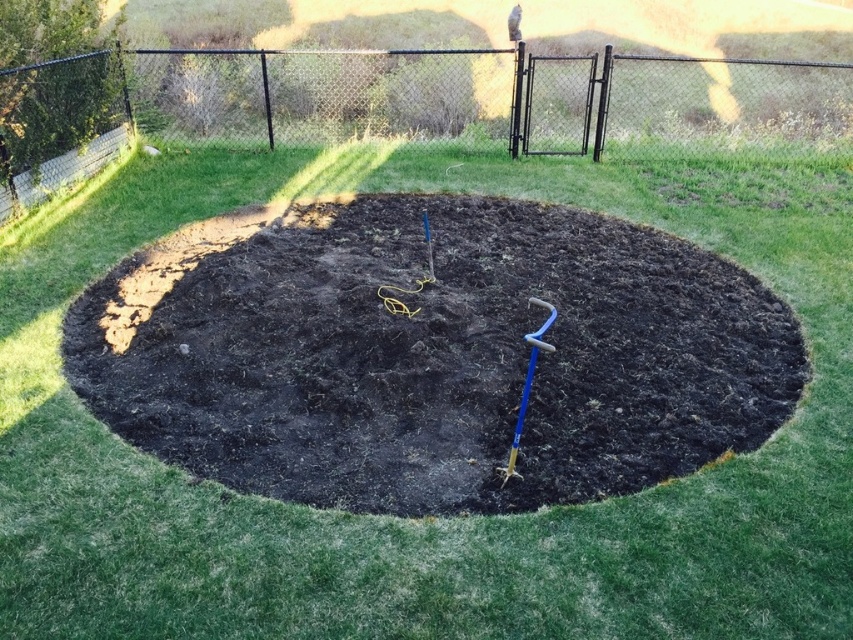
Consider the image. You are planning to plant a small tree in the dark soil at center. The blue plastic shovel at center is your only tool. Considering their sizes, will the shovel be big enough to dig a hole for the tree?

The dark soil at center is larger in size than blue plastic shovel at center, so the shovel may not be large enough to effectively dig a hole in the dark soil at center for the tree.